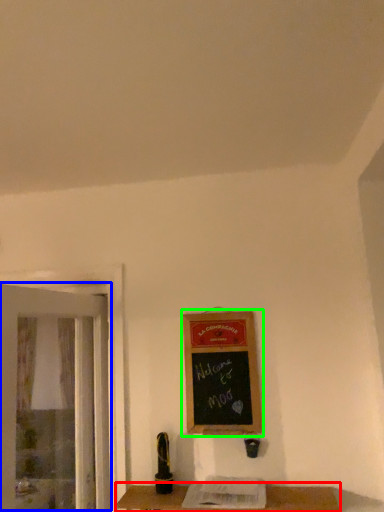
Question: Estimate the real-world distances between objects in this image. Which object is closer to table (highlighted by a red box), screen door (highlighted by a blue box) or bulletin board (highlighted by a green box)?

Choices:
 (A) screen door
 (B) bulletin board

Answer: (B)